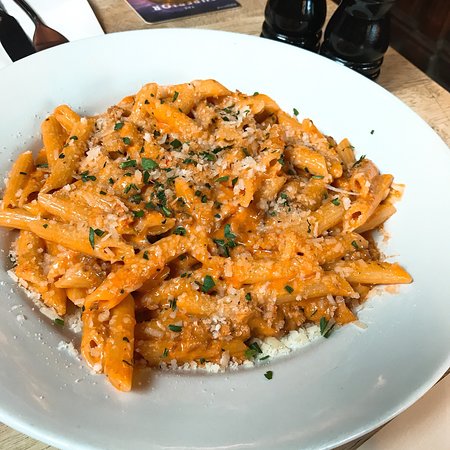
I want to click on table, so click(x=425, y=83).